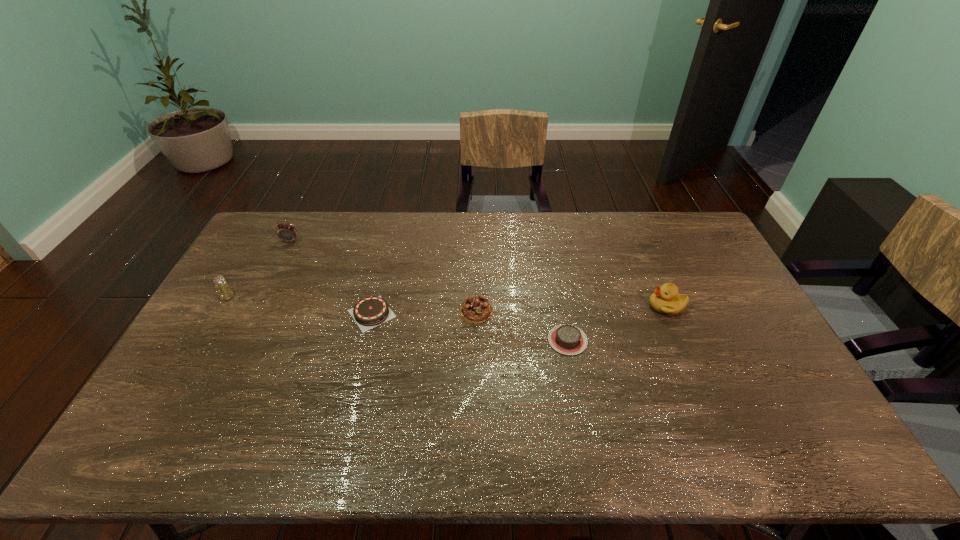
Locate an element on the screen. The width and height of the screenshot is (960, 540). free space between the second chocolate cake from left to right and the fifth object from right to left is located at coordinates (383, 276).

Locate an element on the screen. Image resolution: width=960 pixels, height=540 pixels. empty location between the duckling and the third shortest object is located at coordinates (571, 308).

Where is `free point between the leftmost object and the third object from left to right`? free point between the leftmost object and the third object from left to right is located at coordinates (300, 305).

This screenshot has height=540, width=960. What are the coordinates of `free space that is in between the shortest chocolate cake and the alarm clock` in the screenshot? It's located at tap(429, 291).

Find the location of a particular element. Image resolution: width=960 pixels, height=540 pixels. vacant point located between the third object from left to right and the saltshaker is located at coordinates (300, 305).

Identify the location of free spot between the fifth object from right to left and the shortest chocolate cake. (429, 291).

At what (x,y) coordinates should I click in order to perform the action: click on free space between the second chocolate cake from right to left and the shortest object. Please return your answer as a coordinate pair (x, y). Looking at the image, I should click on (521, 326).

Locate an element on the screen. This screenshot has width=960, height=540. empty space that is in between the farthest object and the fifth tallest object is located at coordinates (331, 277).

Identify which object is the third nearest to the shortest chocolate cake. Please provide its 2D coordinates. Your answer should be formatted as a tuple, i.e. [(x, y)], where the tuple contains the x and y coordinates of a point satisfying the conditions above.

[(369, 312)]

Image resolution: width=960 pixels, height=540 pixels. Identify the location of object that ranks as the second closest to the saltshaker. (x=369, y=312).